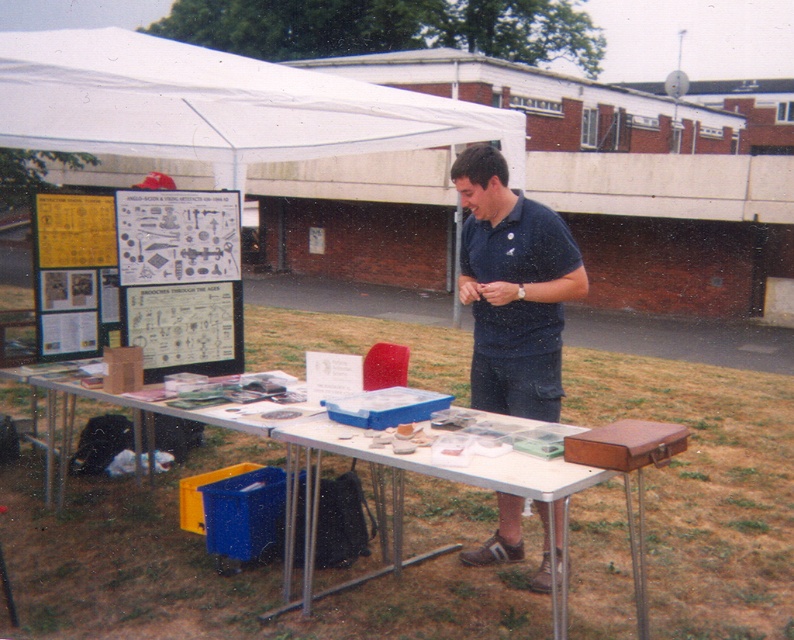
You are a customer at a market stall and want to see the items on the matte plastic table at center. Where should you stand to have a clear view of the items without obstruction from the white fabric canopy at upper left?

You should stand to the right side of the matte plastic table at center because the white fabric canopy at upper left is positioned above it, so standing to the right would avoid the obstruction from the canopy.

You are setting up a tent and need to secure the white fabric canopy at upper left. According to the image, where exactly is the white fabric canopy positioned relative to the table?

The white fabric canopy at upper left is located at point coordinates 0.166 along the x axis and 0.275 along the y axis.

You are a customer at a market stall and see the dark blue shirt at center and the matte plastic table at center. Which object is taller?

The dark blue shirt at center is much taller than the matte plastic table at center.